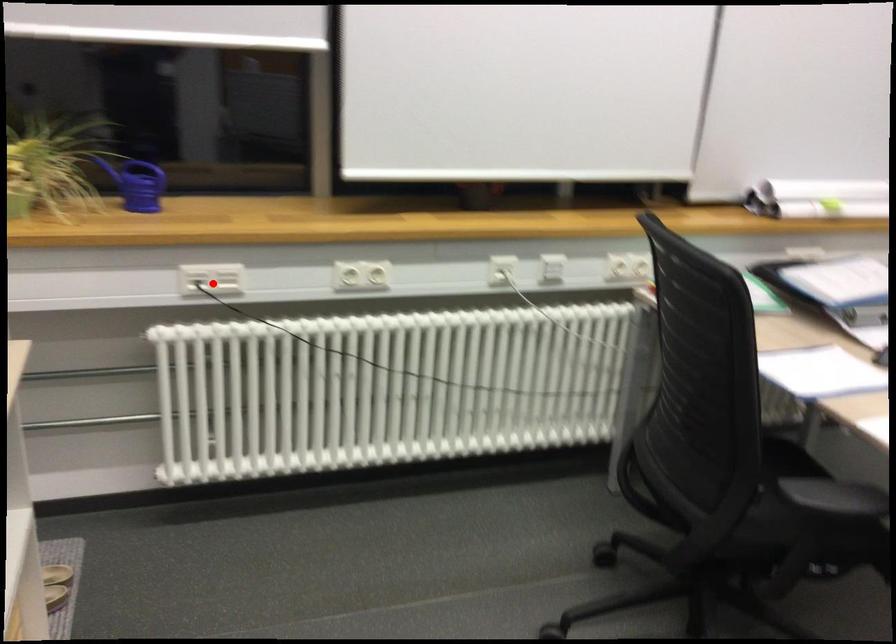
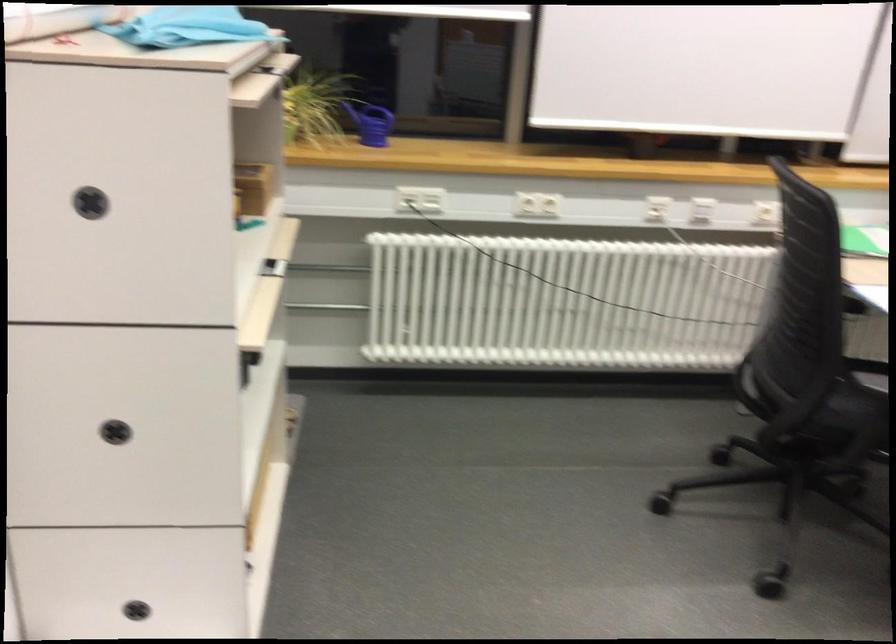
Question: I am providing you with two images of the same scene from different viewpoints. A red point is marked on the first image. Can you still see the location of the red point in image 2?

Choices:
 (A) Yes
 (B) No

Answer: (A)